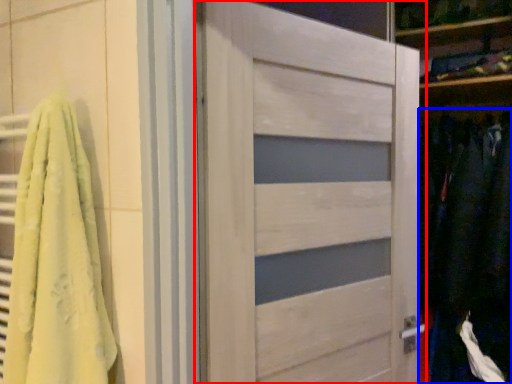
Question: Which object appears closest to the camera in this image, door (highlighted by a red box) or clothing (highlighted by a blue box)?

Choices:
 (A) door
 (B) clothing

Answer: (A)